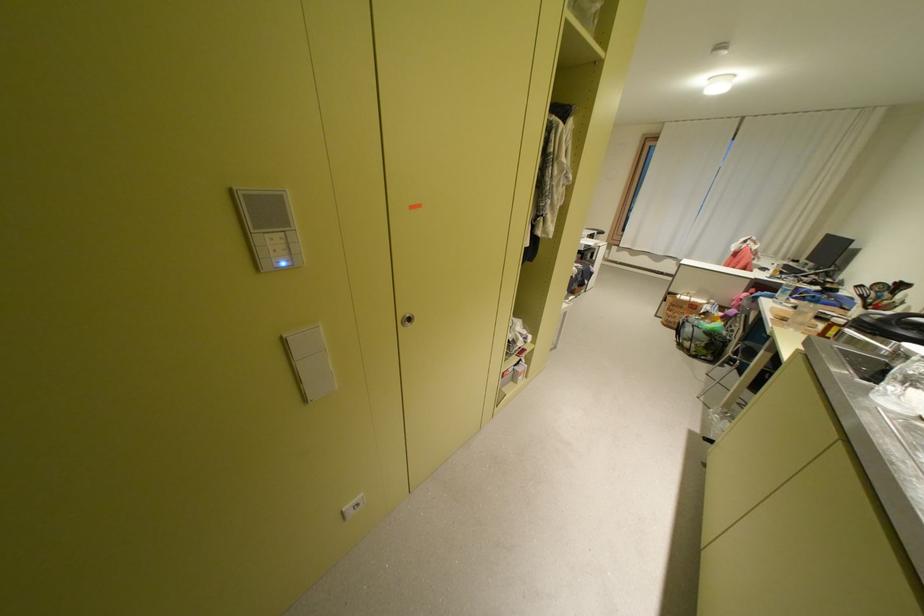
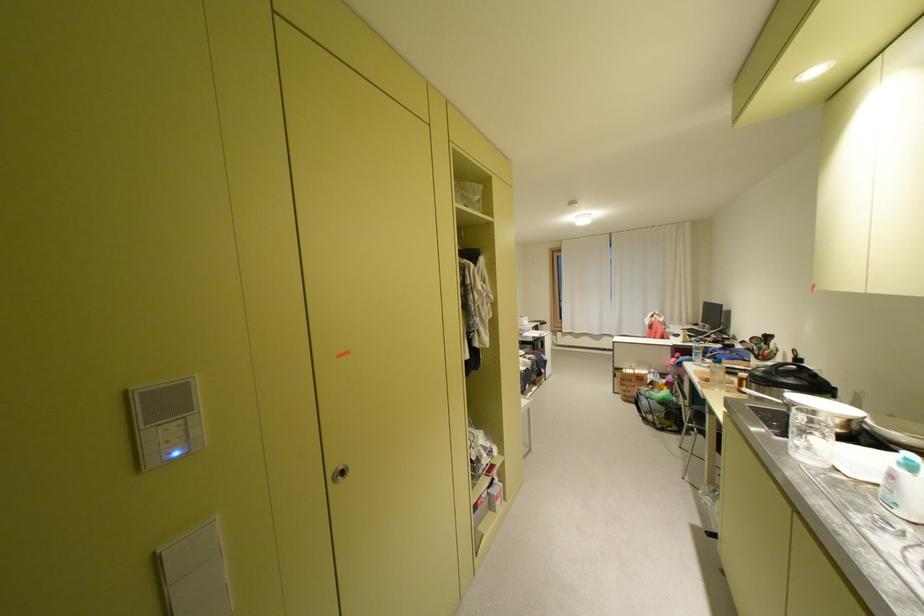
Locate, in the second image, the point that corresponds to (874,379) in the first image.

(789, 436)